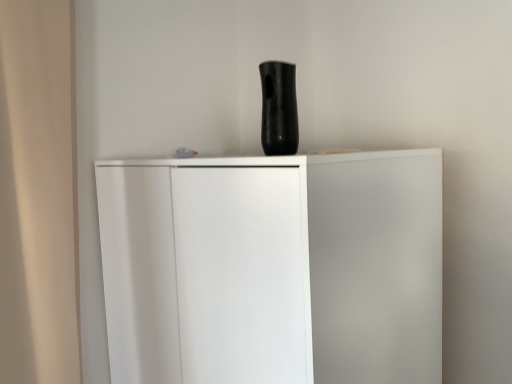
Question: Would you consider black glossy vase at upper center to be distant from white matte cupboard at center?

Choices:
 (A) no
 (B) yes

Answer: (A)

Question: Are black glossy vase at upper center and white matte cupboard at center making contact?

Choices:
 (A) yes
 (B) no

Answer: (B)

Question: Considering the relative positions of black glossy vase at upper center and white matte cupboard at center in the image provided, is black glossy vase at upper center to the right of white matte cupboard at center from the viewer's perspective?

Choices:
 (A) yes
 (B) no

Answer: (A)

Question: From the image's perspective, does black glossy vase at upper center appear lower than white matte cupboard at center?

Choices:
 (A) no
 (B) yes

Answer: (A)

Question: Considering the relative positions of black glossy vase at upper center and white matte cupboard at center in the image provided, is black glossy vase at upper center to the left of white matte cupboard at center from the viewer's perspective?

Choices:
 (A) no
 (B) yes

Answer: (A)

Question: Is black glossy vase at upper center outside of white matte cupboard at center?

Choices:
 (A) yes
 (B) no

Answer: (A)

Question: Is the depth of white matte cupboard at center less than that of black glossy vase at upper center?

Choices:
 (A) yes
 (B) no

Answer: (A)

Question: From a real-world perspective, is white matte cupboard at center on black glossy vase at upper center?

Choices:
 (A) no
 (B) yes

Answer: (A)

Question: From the image's perspective, would you say white matte cupboard at center is positioned over black glossy vase at upper center?

Choices:
 (A) yes
 (B) no

Answer: (B)

Question: Is white matte cupboard at center positioned far away from black glossy vase at upper center?

Choices:
 (A) no
 (B) yes

Answer: (A)

Question: Does white matte cupboard at center have a larger size compared to black glossy vase at upper center?

Choices:
 (A) no
 (B) yes

Answer: (B)

Question: Is white matte cupboard at center taller than black glossy vase at upper center?

Choices:
 (A) yes
 (B) no

Answer: (A)

Question: From their relative heights in the image, would you say black glossy vase at upper center is taller or shorter than white matte cupboard at center?

Choices:
 (A) tall
 (B) short

Answer: (B)